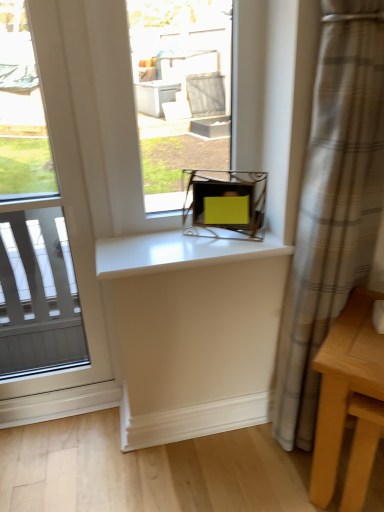
Question: Is plaid fabric curtain at right turned away from matte yellow box at center, which is the 2th window from left to right?

Choices:
 (A) no
 (B) yes

Answer: (A)

Question: Is plaid fabric curtain at right oriented towards matte yellow box at center, which is the 1th window from right to left?

Choices:
 (A) yes
 (B) no

Answer: (B)

Question: Can you confirm if plaid fabric curtain at right is taller than matte yellow box at center, which is the 1th window from right to left?

Choices:
 (A) no
 (B) yes

Answer: (B)

Question: Is plaid fabric curtain at right positioned behind matte yellow box at center, which is the 2th window from left to right?

Choices:
 (A) no
 (B) yes

Answer: (A)

Question: Is plaid fabric curtain at right closer to the viewer compared to matte yellow box at center, which is the 1th window from right to left?

Choices:
 (A) no
 (B) yes

Answer: (B)

Question: Considering the positions of white glossy counter top at center and light wood table at lower right in the image, is white glossy counter top at center taller or shorter than light wood table at lower right?

Choices:
 (A) tall
 (B) short

Answer: (B)

Question: From the image's perspective, is white glossy counter top at center above or below light wood table at lower right?

Choices:
 (A) above
 (B) below

Answer: (A)

Question: In terms of width, does white glossy counter top at center look wider or thinner when compared to light wood table at lower right?

Choices:
 (A) wide
 (B) thin

Answer: (B)

Question: From a real-world perspective, is white glossy counter top at center above or below light wood table at lower right?

Choices:
 (A) above
 (B) below

Answer: (A)

Question: From the image's perspective, is plaid fabric curtain at right above or below clear glass window at left, which appears as the second window when viewed from the right?

Choices:
 (A) below
 (B) above

Answer: (A)

Question: Which is correct: plaid fabric curtain at right is inside clear glass window at left, positioned as the 1th window in left-to-right order, or outside of it?

Choices:
 (A) outside
 (B) inside

Answer: (A)

Question: Considering their positions, is plaid fabric curtain at right located in front of or behind clear glass window at left, which appears as the second window when viewed from the right?

Choices:
 (A) behind
 (B) front

Answer: (B)

Question: Considering the relative positions of plaid fabric curtain at right and clear glass window at left, which appears as the second window when viewed from the right, in the image provided, is plaid fabric curtain at right to the left or to the right of clear glass window at left, which appears as the second window when viewed from the right,?

Choices:
 (A) right
 (B) left

Answer: (A)

Question: In the image, is white glossy counter top at center positioned in front of or behind plaid fabric curtain at right?

Choices:
 (A) front
 (B) behind

Answer: (B)

Question: From a real-world perspective, relative to plaid fabric curtain at right, is white glossy counter top at center vertically above or below?

Choices:
 (A) below
 (B) above

Answer: (B)